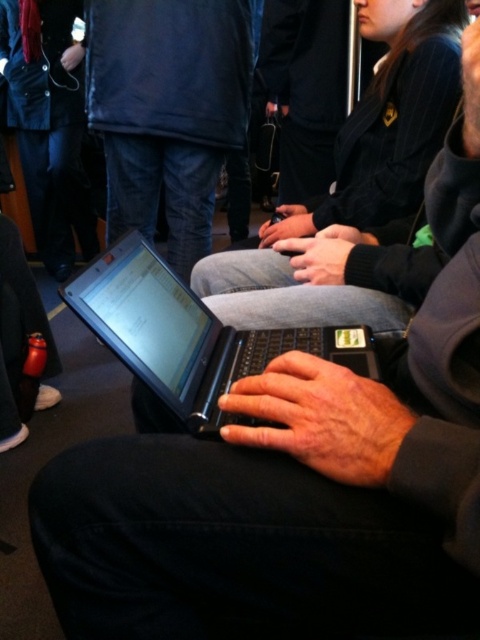
Question: Among these objects, which one is farthest from the camera?

Choices:
 (A) matte black laptop at center
 (B) black glossy laptop at center

Answer: (A)

Question: Is matte black laptop at center below black glossy laptop at center?

Choices:
 (A) yes
 (B) no

Answer: (B)

Question: Which point appears closest to the camera in this image?

Choices:
 (A) (210, 157)
 (B) (155, 266)

Answer: (B)

Question: Can you confirm if matte black laptop at center is positioned below black glossy laptop at center?

Choices:
 (A) no
 (B) yes

Answer: (A)

Question: Does matte black laptop at center appear under black glossy laptop at center?

Choices:
 (A) yes
 (B) no

Answer: (B)

Question: Which point appears closest to the camera in this image?

Choices:
 (A) (184, 300)
 (B) (111, 19)

Answer: (A)